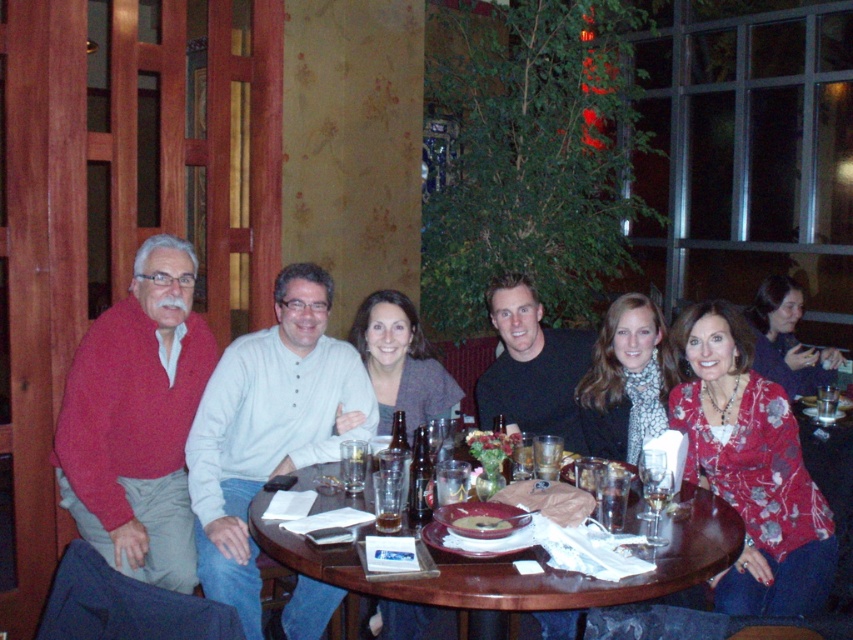
You are a server at the restaurant and need to deliver a drink to the person wearing the matte red sweater at left. The drink must be placed on the brown wooden table at center. Based on their positions, will the server have to move the drink to the left or the right to place it on the table?

The matte red sweater at left is to the left of the brown wooden table at center, so the server will need to move the drink to the right to place it on the table.